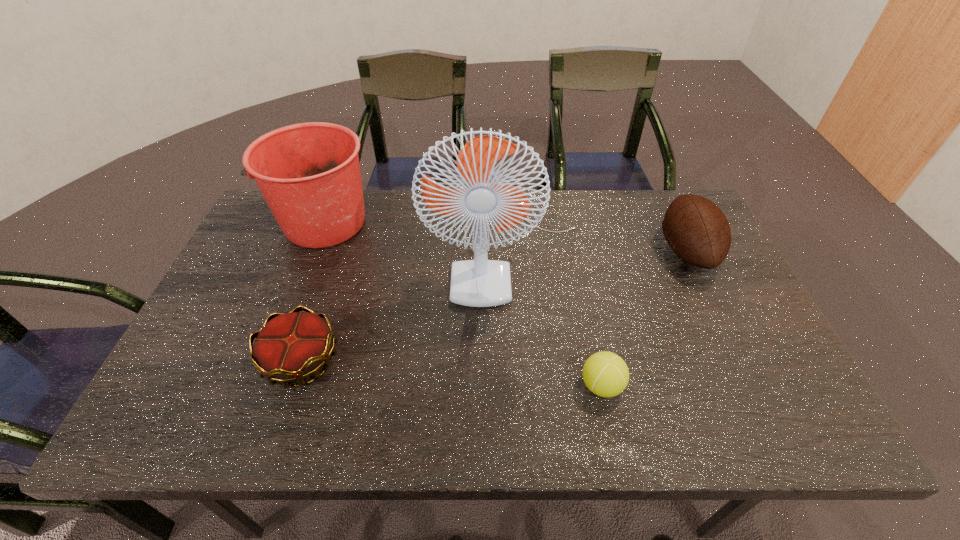
What are the coordinates of `vacant space that satisfies the following two spatial constraints: 1. on the front side of the crown; 2. on the right side of the bucket` in the screenshot? It's located at (271, 360).

You are a GUI agent. You are given a task and a screenshot of the screen. Output one action in this format:
    pyautogui.click(x=<x>, y=<y>)
    Task: Click on the free location that satisfies the following two spatial constraints: 1. on the front side of the crown; 2. on the left side of the tennis ball
    
    Given the screenshot: What is the action you would take?
    pyautogui.click(x=293, y=386)